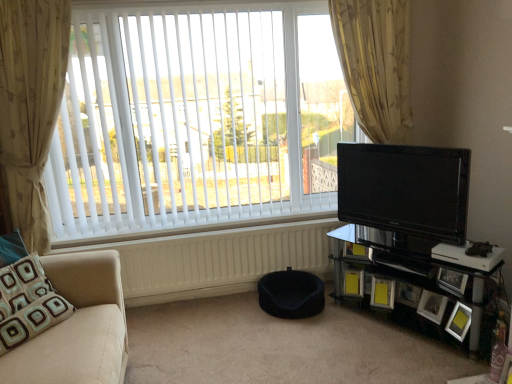
I want to click on free space to the left of wooden picture frame at lower right, marked as the 4th picture frame in a left-to-right arrangement, so click(409, 323).